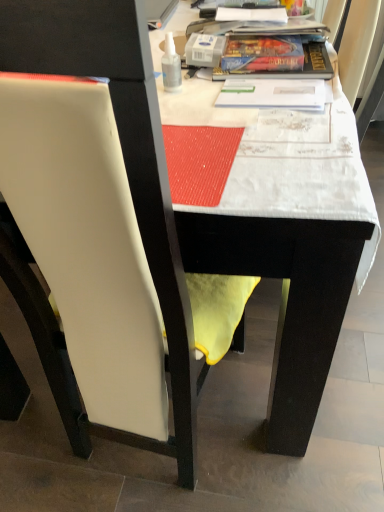
Question: Is white fabric table at upper center a part of transparent plastic bottle at upper center?

Choices:
 (A) yes
 (B) no

Answer: (B)

Question: Considering the relative sizes of transparent plastic bottle at upper center and white fabric table at upper center in the image provided, is transparent plastic bottle at upper center taller than white fabric table at upper center?

Choices:
 (A) no
 (B) yes

Answer: (A)

Question: Could you tell me if transparent plastic bottle at upper center is facing white fabric table at upper center?

Choices:
 (A) yes
 (B) no

Answer: (A)

Question: From a real-world perspective, is transparent plastic bottle at upper center on white fabric table at upper center?

Choices:
 (A) yes
 (B) no

Answer: (A)

Question: From the image's perspective, is transparent plastic bottle at upper center on white fabric table at upper center?

Choices:
 (A) yes
 (B) no

Answer: (A)

Question: Does transparent plastic bottle at upper center appear on the left side of white fabric table at upper center?

Choices:
 (A) yes
 (B) no

Answer: (A)

Question: Is white leather chair at left located outside white fabric table at upper center?

Choices:
 (A) no
 (B) yes

Answer: (B)

Question: Considering the relative positions of white leather chair at left and white fabric table at upper center in the image provided, is white leather chair at left in front of white fabric table at upper center?

Choices:
 (A) yes
 (B) no

Answer: (A)

Question: Is white leather chair at left touching white fabric table at upper center?

Choices:
 (A) no
 (B) yes

Answer: (A)

Question: From a real-world perspective, is white leather chair at left physically above white fabric table at upper center?

Choices:
 (A) yes
 (B) no

Answer: (A)

Question: Can white fabric table at upper center be found inside white leather chair at left?

Choices:
 (A) yes
 (B) no

Answer: (B)

Question: From the image's perspective, is white leather chair at left located above white fabric table at upper center?

Choices:
 (A) no
 (B) yes

Answer: (A)

Question: Does white fabric table at upper center have a smaller size compared to white leather chair at left?

Choices:
 (A) yes
 (B) no

Answer: (A)